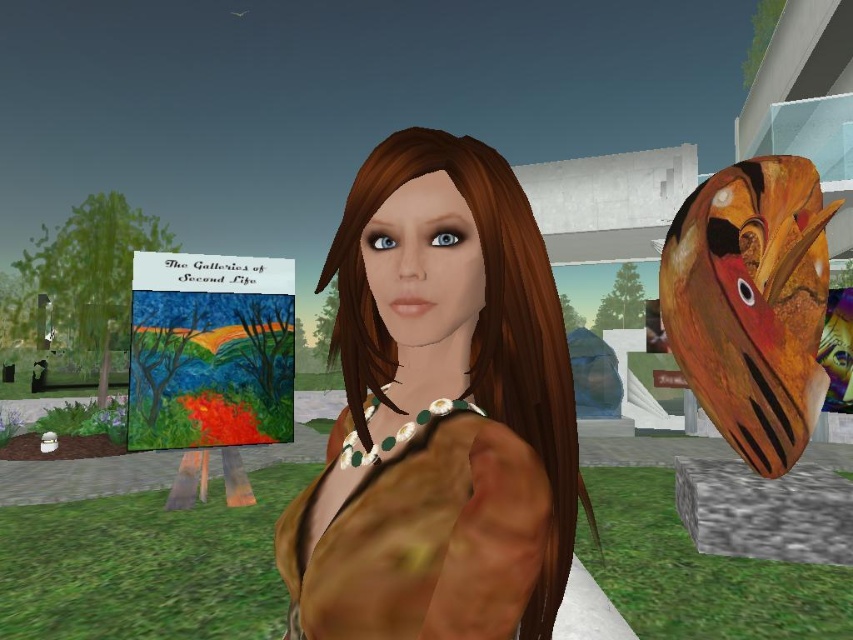
You are a virtual stylist in Second Life preparing to take a photo of the character wearing both the brown matte jacket at center and the brown matte dress at center. Which piece of clothing should you adjust first to ensure it is centered in the frame?

→ The brown matte jacket at center should be adjusted first because it is closer to the viewer than the brown matte dress at center, making it more prominent in the frame.

You are a fashion designer observing a model wearing the brown matte jacket at center and brown matte dress at center. Which clothing item is taller?

The brown matte jacket at center is taller than the brown matte dress at center.

You are a fashion designer observing a model wearing the brown matte jacket at center and brown matte dress at center. Which clothing item has a greater horizontal span when viewed from the front?

The brown matte jacket at center has a greater horizontal span than the brown matte dress at center because its width is larger.